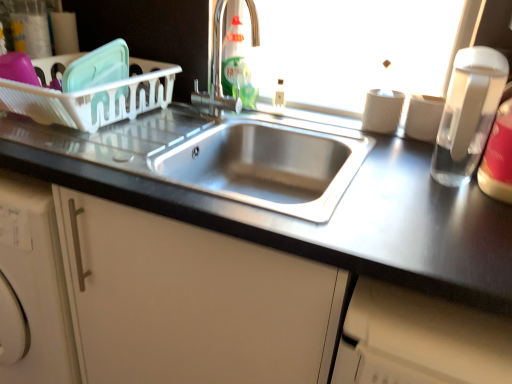
The image size is (512, 384). Find the location of `free point in front of clear glass water bottle at right`. free point in front of clear glass water bottle at right is located at coordinates (451, 213).